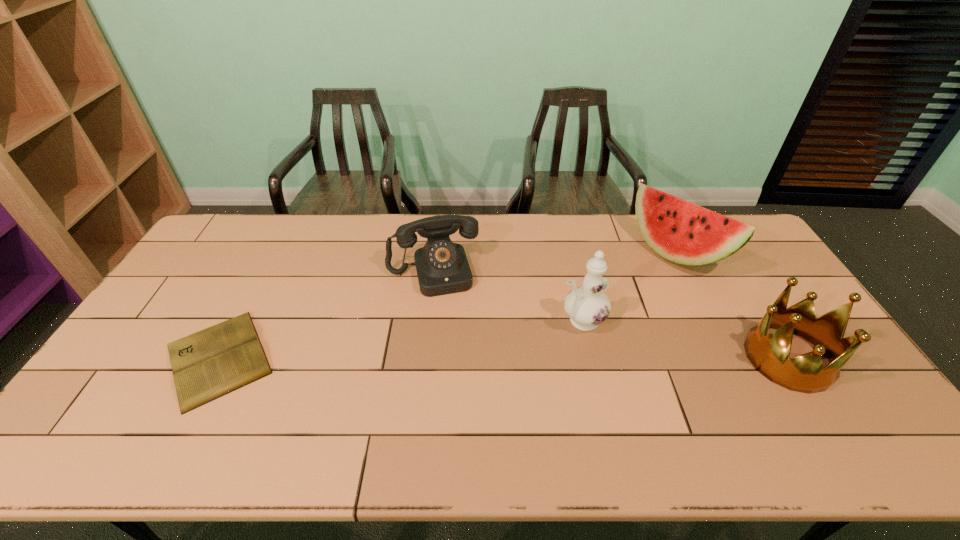
Where is `watermelon located in the far edge section of the desktop`? watermelon located in the far edge section of the desktop is located at coordinates (682, 232).

This screenshot has height=540, width=960. Find the location of `book at the near edge`. book at the near edge is located at coordinates (206, 365).

Locate an element on the screen. This screenshot has height=540, width=960. crown at the near edge is located at coordinates (769, 354).

Locate an element on the screen. The image size is (960, 540). object present at the left edge is located at coordinates (206, 365).

At what (x,y) coordinates should I click in order to perform the action: click on crown that is at the right edge. Please return your answer as a coordinate pair (x, y). Looking at the image, I should click on (769, 354).

This screenshot has height=540, width=960. What are the coordinates of `watermelon that is at the right edge` in the screenshot? It's located at (682, 232).

The height and width of the screenshot is (540, 960). What are the coordinates of `object located in the near left corner section of the desktop` in the screenshot? It's located at (206, 365).

Locate an element on the screen. object that is positioned at the far right corner is located at coordinates (682, 232).

Locate an element on the screen. object that is at the near right corner is located at coordinates (769, 354).

Find the location of a particular element. Image resolution: width=960 pixels, height=540 pixels. vacant position at the far edge of the desktop is located at coordinates (360, 234).